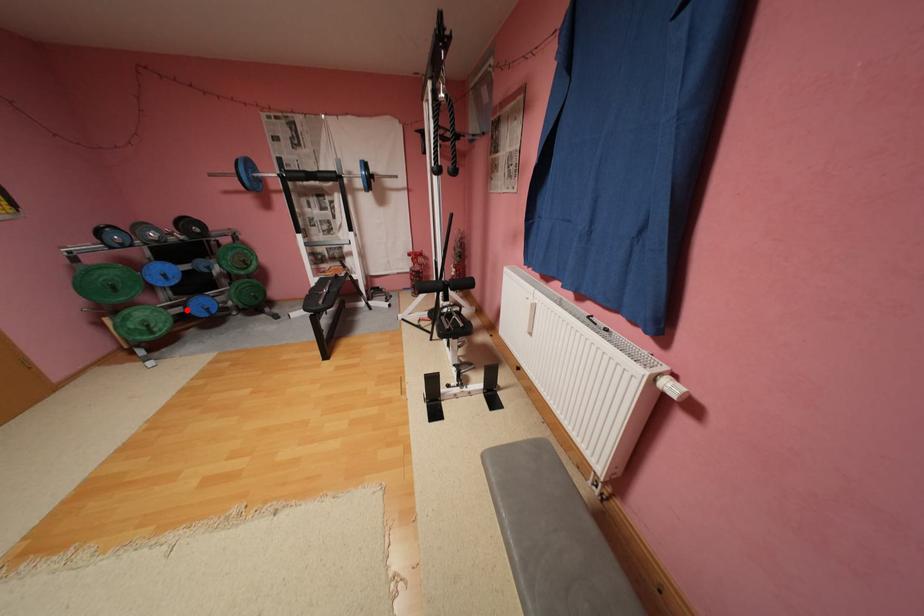
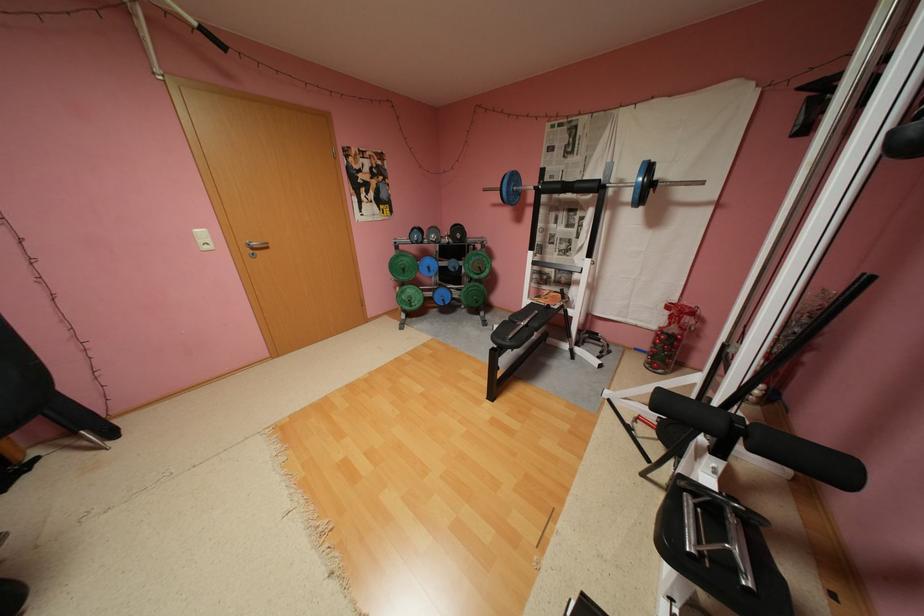
Question: I am providing you with two images of the same scene from different viewpoints. Image1 has a red point marked. In image2, the corresponding 3D location appears at what relative position? Reply with the corresponding letter.

Choices:
 (A) Closer
 (B) Farther

Answer: (B)